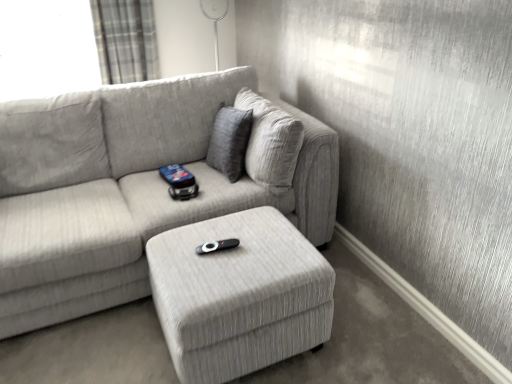
This screenshot has width=512, height=384. Identify the location of vacant area in front of black plastic remote at center. (220, 273).